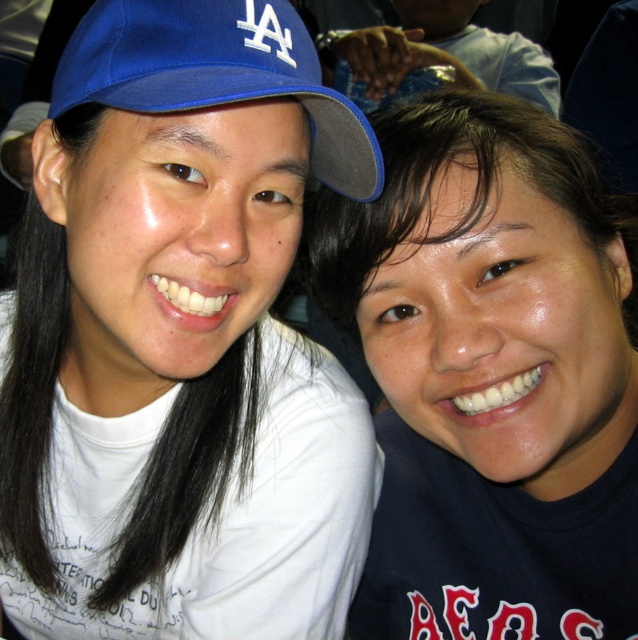
Based on the photo, you are taking a photo of two people standing side by side. You notice the matte black shirt at center and the blue fabric cap at left. Which object is positioned lower in the image?

The matte black shirt at center is below the blue fabric cap at left, so it is positioned lower in the image.

You are standing in front of the two people in the image. You want to hand a gift to the person wearing the matte black shirt at center. Which direction should you walk to approach them?

The matte black shirt at center is located at point 0.589 on the horizontal axis and 0.770 on the vertical axis. Since you are facing the image, you should walk towards the center area slightly to the right and lower middle to reach the person wearing the matte black shirt at center.

You are a photographer trying to focus on the matte white shirt at center and the matte black shirt at center in the image. Which shirt should you adjust your focus to first if you want to capture both clearly?

The matte white shirt at center is positioned over the matte black shirt at center, so you should focus on the matte white shirt at center first as it is closer to the camera.